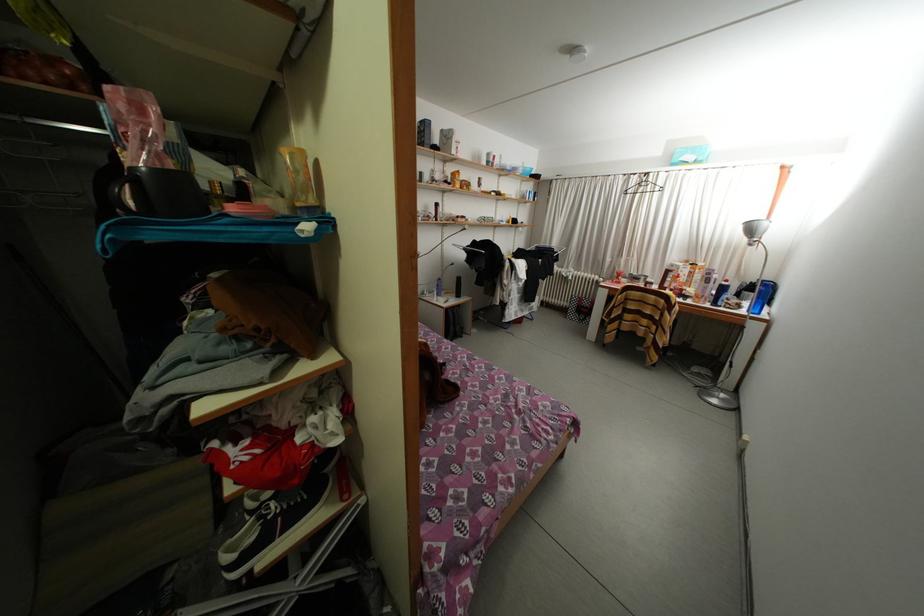
Which object does [299,180] point to?

It corresponds to the yellow squeeze bottle in the image.